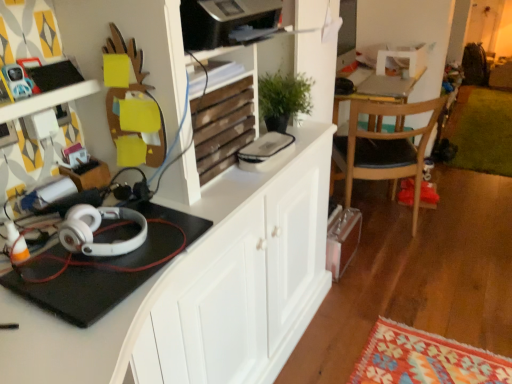
Measure the distance between white matte headphones at left and camera.

They are 34.27 inches apart.

What is the approximate height of white matte headphones at left?

The height of white matte headphones at left is 2.99 inches.

Image resolution: width=512 pixels, height=384 pixels. What are the coordinates of `white matte cabinet at center` in the screenshot? It's located at pos(202,288).

Describe the element at coordinates (202, 288) in the screenshot. The height and width of the screenshot is (384, 512). I see `white matte cabinet at center` at that location.

Where is `wooden at upper center`? wooden at upper center is located at coordinates (225, 123).

Locate an element on the screen. The image size is (512, 384). wooden chair with black seat cushion at right is located at coordinates (385, 148).

Consider the image. Based on their positions, is wooden at upper center located to the left or right of green plush rug at lower right?

wooden at upper center is to the left of green plush rug at lower right.

From the picture: Between wooden at upper center and green plush rug at lower right, which one has larger size?

Bigger between the two is green plush rug at lower right.

Considering the sizes of wooden at upper center and green plush rug at lower right in the image, is wooden at upper center taller or shorter than green plush rug at lower right?

Clearly, wooden at upper center is taller compared to green plush rug at lower right.

Identify the location of cabinetry in front of the white matte headphones at left. (202, 288).

Between point (270, 306) and point (72, 251), which one is positioned in front?

The point (72, 251) is closer.

Which object is further away from the camera taking this photo, white matte cabinet at center or white matte headphones at left?

white matte headphones at left is behind.

Which is less distant, (x=465, y=87) or (x=245, y=103)?

The point (x=245, y=103) is closer to the camera.

From a real-world perspective, is green plush rug at lower right physically above wooden at upper center?

No.

Is green plush rug at lower right taller or shorter than wooden at upper center?

Considering their sizes, green plush rug at lower right has less height than wooden at upper center.

From the image's perspective, does green plush rug at lower right appear higher than wooden at upper center?

Correct, green plush rug at lower right appears higher than wooden at upper center in the image.

Is white matte headphones at left inside or outside of wooden chair with black seat cushion at right?

white matte headphones at left is spatially situated outside wooden chair with black seat cushion at right.

Can you confirm if white matte headphones at left is taller than wooden chair with black seat cushion at right?

In fact, white matte headphones at left may be shorter than wooden chair with black seat cushion at right.

Is white matte headphones at left placed right next to wooden chair with black seat cushion at right?

No, white matte headphones at left is not next to wooden chair with black seat cushion at right.

Is point (145, 236) behind point (350, 119)?

No, it is not.

Is there a large distance between wooden chair with black seat cushion at right and matte black phone at upper left?

Indeed, wooden chair with black seat cushion at right is not near matte black phone at upper left.

Is wooden chair with black seat cushion at right completely or partially outside of matte black phone at upper left?

wooden chair with black seat cushion at right is positioned outside matte black phone at upper left.

Relative to matte black phone at upper left, is wooden chair with black seat cushion at right in front or behind?

Visually, wooden chair with black seat cushion at right is located behind matte black phone at upper left.

Which of these two, wooden chair with black seat cushion at right or matte black phone at upper left, is wider?

With larger width is wooden chair with black seat cushion at right.

Is white matte headphones at left situated inside wooden at upper center or outside?

white matte headphones at left cannot be found inside wooden at upper center.

Considering the relative sizes of white matte headphones at left and wooden at upper center in the image provided, is white matte headphones at left wider than wooden at upper center?

In fact, white matte headphones at left might be narrower than wooden at upper center.

How different are the orientations of white matte headphones at left and wooden at upper center in degrees?

The angular difference between white matte headphones at left and wooden at upper center is 0.00147 degrees.

Between white matte headphones at left and wooden at upper center, which one has more height?

With more height is wooden at upper center.

How different are the orientations of matte black phone at upper left and wooden at upper center in degrees?

They differ by 9.59 degrees in their facing directions.

Is matte black phone at upper left looking in the opposite direction of wooden at upper center?

matte black phone at upper left does not have its back to wooden at upper center.

In the scene shown: Which object is positioned more to the left, matte black phone at upper left or wooden at upper center?

matte black phone at upper left is more to the left.

You are a GUI agent. You are given a task and a screenshot of the screen. Output one action in this format:
    pyautogui.click(x=<x>, y=<y>)
    Task: Click on the mat lying above the wooden at upper center (from the image's perspective)
    This screenshot has width=512, height=384.
    Given the screenshot: What is the action you would take?
    pyautogui.click(x=482, y=130)

There is a white matte cabinet at center. Where is `headphones above it (from a real-world perspective)`? This screenshot has width=512, height=384. headphones above it (from a real-world perspective) is located at coordinates (97, 229).

Considering their positions, is matte black phone at upper left positioned further to wooden at upper center than wooden chair with black seat cushion at right?

wooden chair with black seat cushion at right.

From the image, which object appears to be nearer to wooden at upper center, matte black phone at upper left or green plush rug at lower right?

matte black phone at upper left is positioned closer to the anchor wooden at upper center.

Considering their positions, is green plush rug at lower right positioned closer to wooden at upper center than matte black phone at upper left?

matte black phone at upper left lies closer to wooden at upper center than the other object.

When comparing their distances from white matte headphones at left, does matte black phone at upper left or wooden at upper center seem closer?

matte black phone at upper left.

Looking at this image, which object lies nearer to the anchor point green plush rug at lower right, white matte cabinet at center or wooden at upper center?

Among the two, white matte cabinet at center is located nearer to green plush rug at lower right.

When comparing their distances from matte black phone at upper left, does wooden chair with black seat cushion at right or green plush rug at lower right seem closer?

wooden chair with black seat cushion at right.

Estimate the real-world distances between objects in this image. Which object is further from matte black phone at upper left, wooden at upper center or green plush rug at lower right?

green plush rug at lower right.

Considering their positions, is white matte cabinet at center positioned closer to matte black phone at upper left than green plush rug at lower right?

white matte cabinet at center lies closer to matte black phone at upper left than the other object.

Where is `chair located between white matte cabinet at center and green plush rug at lower right in the depth direction`? The height and width of the screenshot is (384, 512). chair located between white matte cabinet at center and green plush rug at lower right in the depth direction is located at coordinates (385, 148).

I want to click on toy between white matte cabinet at center and wooden at upper center from front to back, so 17,81.

What are the coordinates of `cabinetry between matte black phone at upper left and green plush rug at lower right from left to right` in the screenshot? It's located at (202, 288).

At what (x,y) coordinates should I click in order to perform the action: click on shelf between white matte cabinet at center and green plush rug at lower right along the z-axis. Please return your answer as a coordinate pair (x, y). Looking at the image, I should click on (225, 123).